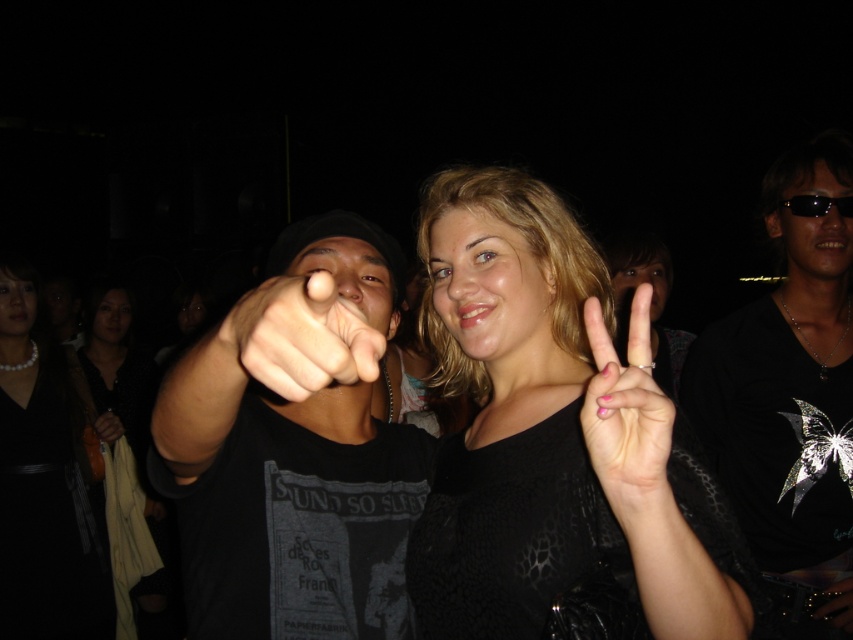
You are at a party and want to take a photo of the two people in the center. The person wearing the black textured sweater at center is blocking your view of the blonde hair at center. Can you move the sweater to the left to see the hair better?

The black textured sweater at center is positioned on the right side of blonde hair at center, so moving it to the left would allow you to see the blonde hair at center more clearly.